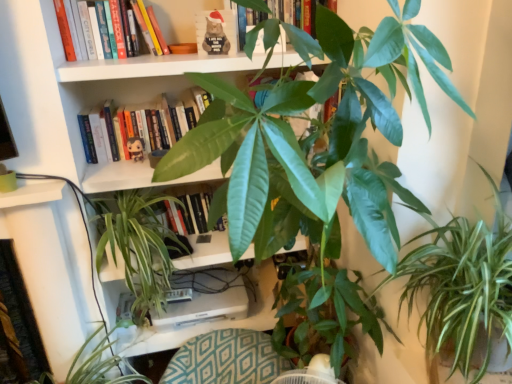
Question: Relative to green leafy plant at lower left, the 1th houseplant from the left, is green glossy plant at center, the 2th houseplant in the right-to-left sequence, in front or behind?

Choices:
 (A) front
 (B) behind

Answer: (B)

Question: Considering the positions of green glossy plant at center, which ranks as the second houseplant in left-to-right order, and green leafy plant at lower left, the 1th houseplant from the left, in the image, is green glossy plant at center, which ranks as the second houseplant in left-to-right order, wider or thinner than green leafy plant at lower left, the 1th houseplant from the left,?

Choices:
 (A) thin
 (B) wide

Answer: (B)

Question: Considering the real-world distances, which object is farthest from the green leafy plant at lower right?

Choices:
 (A) green glossy leafy plant at center, which is the third houseplant in left-to-right order
 (B) green glossy plant at center, which ranks as the second houseplant in left-to-right order
 (C) matte black plush toy at upper center
 (D) hardcover book at upper left, the 2th book from the bottom
 (E) green leafy plant at lower left, the 1th houseplant from the left

Answer: (D)

Question: Which object is positioned closest to the teal fabric swivel chair at center?

Choices:
 (A) matte black plush toy at upper center
 (B) green glossy leafy plant at center, the first houseplant positioned from the right
 (C) green leafy plant at lower right
 (D) green matte book at upper center, the first book positioned from the bottom
 (E) green leafy plant at lower left, the 1th houseplant from the left

Answer: (E)